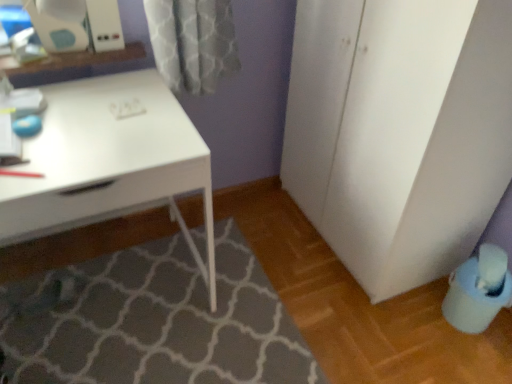
Identify the location of free space between white matte cabinet at right and blue plastic swivel chair at lower right. (420, 316).